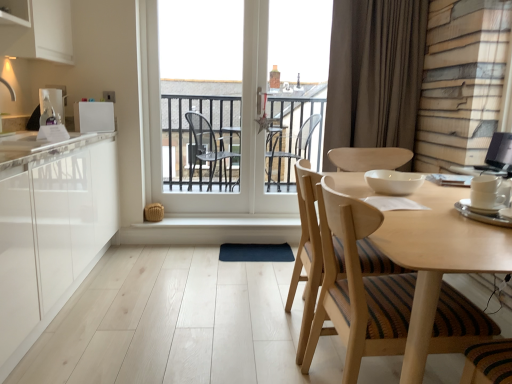
Measure the distance between white glossy bowl at center, the 3th appliance from the left, and camera.

They are 1.89 meters apart.

At what (x,y) coordinates should I click in order to perform the action: click on white glossy bowl at center, the 3th appliance from the left. Please return your answer as a coordinate pair (x, y). The height and width of the screenshot is (384, 512). Looking at the image, I should click on (393, 182).

This screenshot has width=512, height=384. What are the coordinates of `dark blue rubber mat at center` in the screenshot? It's located at (256, 253).

What is the approximate width of white glossy countertop at left?

The width of white glossy countertop at left is 22.35 inches.

Identify the location of black glossy monitor at upper right, the first appliance from the right. The image size is (512, 384). (499, 154).

Locate an element on the screen. white glass door at center is located at coordinates (242, 100).

Does dark blue rubber mat at center have a lesser height compared to brown fabric curtain at upper right?

Yes, dark blue rubber mat at center is shorter than brown fabric curtain at upper right.

Is dark blue rubber mat at center inside or outside of brown fabric curtain at upper right?

dark blue rubber mat at center lies outside brown fabric curtain at upper right.

Who is bigger, dark blue rubber mat at center or brown fabric curtain at upper right?

brown fabric curtain at upper right.

Is brown fabric curtain at upper right far from white glass door at center?

No, brown fabric curtain at upper right is not far away from white glass door at center.

From a real-world perspective, which is physically above, brown fabric curtain at upper right or white glass door at center?

In real-world perspective, brown fabric curtain at upper right is above.

Is brown fabric curtain at upper right shorter than white glass door at center?

Indeed, brown fabric curtain at upper right has a lesser height compared to white glass door at center.

Are white glossy countertop at left and light wood round table at center located far from each other?

Yes, white glossy countertop at left is far from light wood round table at center.

From a real-world perspective, is white glossy countertop at left physically located above or below light wood round table at center?

Clearly, from a real-world perspective, white glossy countertop at left is above light wood round table at center.

From the image's perspective, relative to light wood round table at center, is white glossy countertop at left above or below?

Clearly, from the image's perspective, white glossy countertop at left is above light wood round table at center.

Does white glossy refrigerator at upper left, placed as the second appliance when sorted from left to right, touch white glossy countertop at left?

No, white glossy refrigerator at upper left, placed as the second appliance when sorted from left to right, is not in contact with white glossy countertop at left.

From the image's perspective, starting from the white glossy countertop at left, which appliance is the 1st one above? Please provide its 2D coordinates.

[(94, 116)]

Do you think white glossy refrigerator at upper left, the second appliance viewed from the back, is within white glossy countertop at left, or outside of it?

white glossy refrigerator at upper left, the second appliance viewed from the back, is not enclosed by white glossy countertop at left.

From a real-world perspective, is white glossy refrigerator at upper left, placed as the second appliance when sorted from left to right, below white glossy countertop at left?

No, from a real-world perspective, white glossy refrigerator at upper left, placed as the second appliance when sorted from left to right, is not beneath white glossy countertop at left.

Is black glossy monitor at upper right, which ranks as the 3th appliance in front-to-back order, inside the boundaries of dark blue rubber mat at center, or outside?

black glossy monitor at upper right, which ranks as the 3th appliance in front-to-back order, is outside dark blue rubber mat at center.

Can you tell me how much black glossy monitor at upper right, the 5th appliance in the left-to-right sequence, and dark blue rubber mat at center differ in facing direction?

There is a 88.8-degree angle between the facing directions of black glossy monitor at upper right, the 5th appliance in the left-to-right sequence, and dark blue rubber mat at center.

Considering the relative positions of black glossy monitor at upper right, the first appliance from the right, and dark blue rubber mat at center in the image provided, is black glossy monitor at upper right, the first appliance from the right, to the right of dark blue rubber mat at center from the viewer's perspective?

Indeed, black glossy monitor at upper right, the first appliance from the right, is positioned on the right side of dark blue rubber mat at center.

From a real-world perspective, between black glossy monitor at upper right, which ranks as the 3th appliance in front-to-back order, and dark blue rubber mat at center, who is vertically lower?

dark blue rubber mat at center is physically lower.

From the image's perspective, which is below, light wood round table at center or matte white soap dispenser at left, which ranks as the fifth appliance in right-to-left order?

light wood round table at center is shown below in the image.

Does light wood round table at center have a larger size compared to matte white soap dispenser at left, which ranks as the 1th appliance in back-to-front order?

Correct, light wood round table at center is larger in size than matte white soap dispenser at left, which ranks as the 1th appliance in back-to-front order.

Can you tell me how much light wood round table at center and matte white soap dispenser at left, which ranks as the 1th appliance in back-to-front order, differ in facing direction?

6.97 degrees separate the facing orientations of light wood round table at center and matte white soap dispenser at left, which ranks as the 1th appliance in back-to-front order.

Considering the relative sizes of light wood round table at center and matte white soap dispenser at left, which ranks as the fifth appliance in right-to-left order, in the image provided, is light wood round table at center taller than matte white soap dispenser at left, which ranks as the fifth appliance in right-to-left order,?

Yes.

From a real-world perspective, relative to white glossy refrigerator at upper left, positioned as the fourth appliance in front-to-back order, is matte white soap dispenser at left, which ranks as the fifth appliance in right-to-left order, vertically above or below?

Clearly, from a real-world perspective, matte white soap dispenser at left, which ranks as the fifth appliance in right-to-left order, is above white glossy refrigerator at upper left, positioned as the fourth appliance in front-to-back order.

Locate an element on the screen. The image size is (512, 384). the 1st appliance below the matte white soap dispenser at left, which ranks as the fifth appliance in right-to-left order (from a real-world perspective) is located at coordinates (94, 116).

Is matte white soap dispenser at left, which ranks as the fifth appliance in right-to-left order, looking in the opposite direction of white glossy refrigerator at upper left, placed as the second appliance when sorted from left to right?

No, matte white soap dispenser at left, which ranks as the fifth appliance in right-to-left order,'s orientation is not away from white glossy refrigerator at upper left, placed as the second appliance when sorted from left to right.

From the picture: Relative to white glossy refrigerator at upper left, positioned as the fourth appliance in front-to-back order, is matte white soap dispenser at left, the 5th appliance from the front, in front or behind?

matte white soap dispenser at left, the 5th appliance from the front, is positioned farther from the viewer than white glossy refrigerator at upper left, positioned as the fourth appliance in front-to-back order.

Identify the location of wide lying on the left of brown fabric curtain at upper right. The image size is (512, 384). (256, 253).

Locate an element on the screen. window lying below the brown fabric curtain at upper right (from the image's perspective) is located at coordinates (242, 100).

Looking at the image, which one is located closer to black glossy monitor at upper right, the 5th appliance in the left-to-right sequence, matte white soap dispenser at left, which ranks as the 1th appliance in back-to-front order, or wooden chair with striped cushion at center?

wooden chair with striped cushion at center.

Based on their spatial positions, is dark blue rubber mat at center or black glossy monitor at upper right, which ranks as the 3th appliance in front-to-back order, further from wooden chair with striped cushion at center?

The object further to wooden chair with striped cushion at center is dark blue rubber mat at center.

When comparing their distances from white glossy countertop at left, does white glass door at center or wooden chair with striped cushion at center seem further?

wooden chair with striped cushion at center.

Based on their spatial positions, is white ceramic cup at right, the 4th appliance positioned from the left, or white glossy bowl at center, the 4th appliance in the back-to-front sequence, further from light wood round table at center?

The object further to light wood round table at center is white ceramic cup at right, the 4th appliance positioned from the left.

When comparing their distances from white ceramic cup at right, the first appliance from the front, does white glossy bowl at center, the 3th appliance from the left, or dark blue rubber mat at center seem further?

Based on the image, dark blue rubber mat at center appears to be further to white ceramic cup at right, the first appliance from the front.

From the image, which object appears to be farther from brown fabric curtain at upper right, white ceramic cup at right, the first appliance from the front, or white glossy countertop at left?

white glossy countertop at left lies further to brown fabric curtain at upper right than the other object.

When comparing their distances from light wood round table at center, does brown fabric curtain at upper right or wooden chair with striped cushion at center seem closer?

Based on the image, wooden chair with striped cushion at center appears to be nearer to light wood round table at center.

Based on their spatial positions, is matte white soap dispenser at left, the 5th appliance from the front, or white glossy countertop at left further from wooden chair with striped cushion at center?

matte white soap dispenser at left, the 5th appliance from the front.

Locate an element on the screen. The height and width of the screenshot is (384, 512). wide between white glossy countertop at left and white glossy bowl at center, which is the 2th appliance in front-to-back order is located at coordinates (256, 253).

Find the location of `chair between matte white soap dispenser at left, which ranks as the 1th appliance in back-to-front order, and white glossy bowl at center, the 3th appliance from the left`. chair between matte white soap dispenser at left, which ranks as the 1th appliance in back-to-front order, and white glossy bowl at center, the 3th appliance from the left is located at coordinates tap(307, 252).

The height and width of the screenshot is (384, 512). In order to click on wide located between matte white soap dispenser at left, the 5th appliance from the front, and white ceramic cup at right, the first appliance from the front, in the left-right direction in this screenshot , I will do (x=256, y=253).

You are a GUI agent. You are given a task and a screenshot of the screen. Output one action in this format:
    pyautogui.click(x=<x>, y=<y>)
    Task: Click on the window between white glossy countertop at left and white glossy bowl at center, which is the 2th appliance in front-to-back order
    
    Given the screenshot: What is the action you would take?
    pyautogui.click(x=242, y=100)